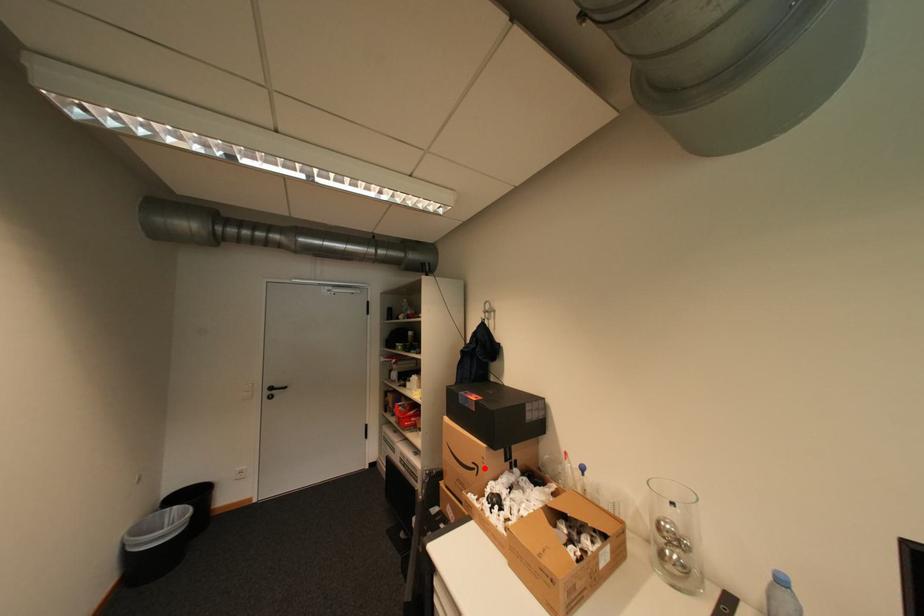
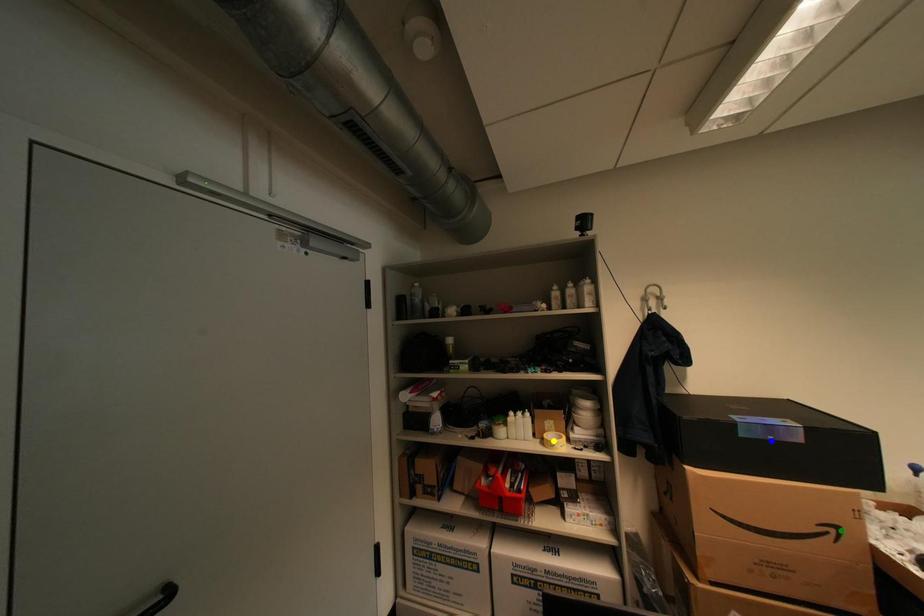
Question: I am providing you with two images of the same scene from different viewpoints. A red point is marked on the first image. You are given multiple points on the second image. Which spot in image 2 lines up with the point in image 1?

Choices:
 (A) blue point
 (B) yellow point
 (C) green point

Answer: (C)